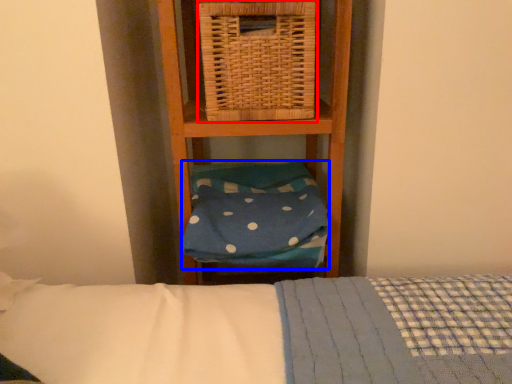
Question: Which of the following is the farthest to the observer, picnic basket (highlighted by a red box) or pillow (highlighted by a blue box)?

Choices:
 (A) picnic basket
 (B) pillow

Answer: (B)